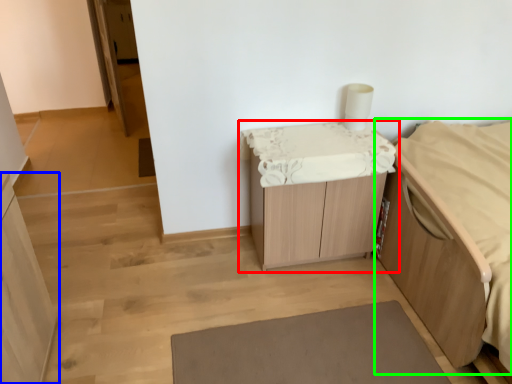
Question: Which object is positioned farthest from table (highlighted by a red box)? Select from cabinetry (highlighted by a blue box) and furniture (highlighted by a green box).

Choices:
 (A) cabinetry
 (B) furniture

Answer: (A)